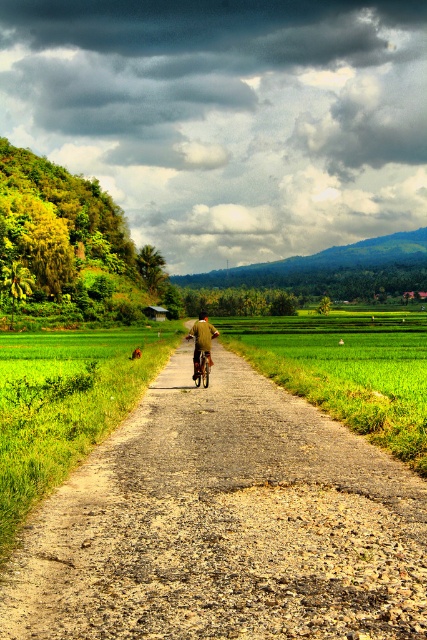
Consider the image. You are a hiker standing at the edge of the brown gravel road at center. You notice a brown fabric jacket at center lying somewhere in relation to the road. Based on the scene description, where is the jacket located relative to the road?

The brown fabric jacket at center is above the brown gravel road at center, as the road is positioned below the jacket according to the description.

You are a hiker carrying a brown fabric jacket at center and walking along the brown gravel road at center. You want to place your jacket on the ground next to the road. On which side of the jacket should you place the road to ensure it stays visible?

The brown gravel road at center is positioned on the right side of brown fabric jacket at center, so to keep the road visible, you should place the jacket to the left side of the road.